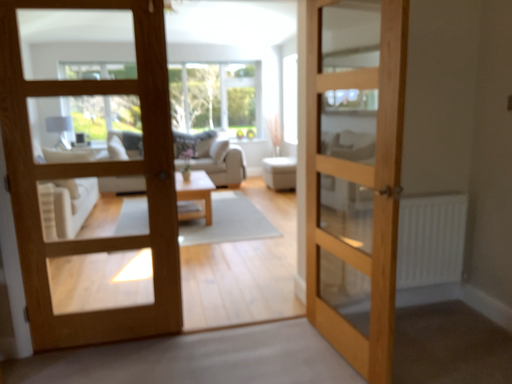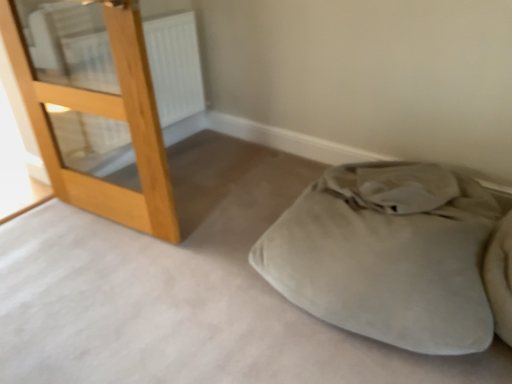
Question: How did the camera likely rotate when shooting the video?

Choices:
 (A) rotated downward
 (B) rotated upward

Answer: (A)